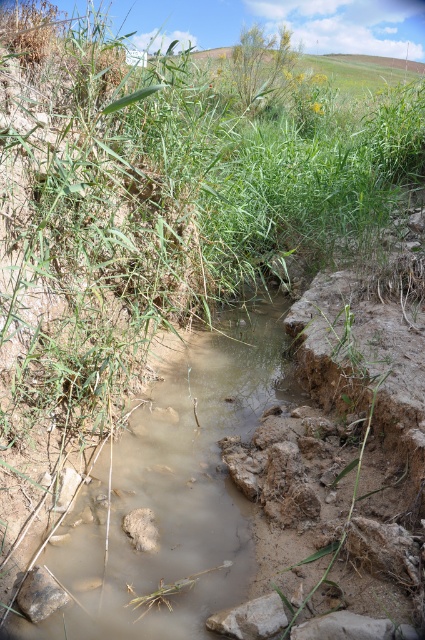
You are standing at the edge of the stream and want to cross to the other side. You see the muddy water at center and the gray rough rock at lower center. Which object is closer to you as you plan your path?

The muddy water at center is closer to you than the gray rough rock at lower center because it is further away.

You are a hiker trying to cross the stream. You see the muddy water at center and the gray rough rock at lower center. Which object is larger in size?

The muddy water at center is bigger than the gray rough rock at lower center according to the description.

You are trying to cross the stream using a wooden plank that is 1 meter wide. The stream has the muddy water at center and gray rough rock at lower center. Which part of the stream should you place the plank to ensure it spans the stream without getting submerged?

You should place the plank over the gray rough rock at lower center because the muddy water at center is wider than the rock, so the rock is narrower and the plank can span it without submersion.